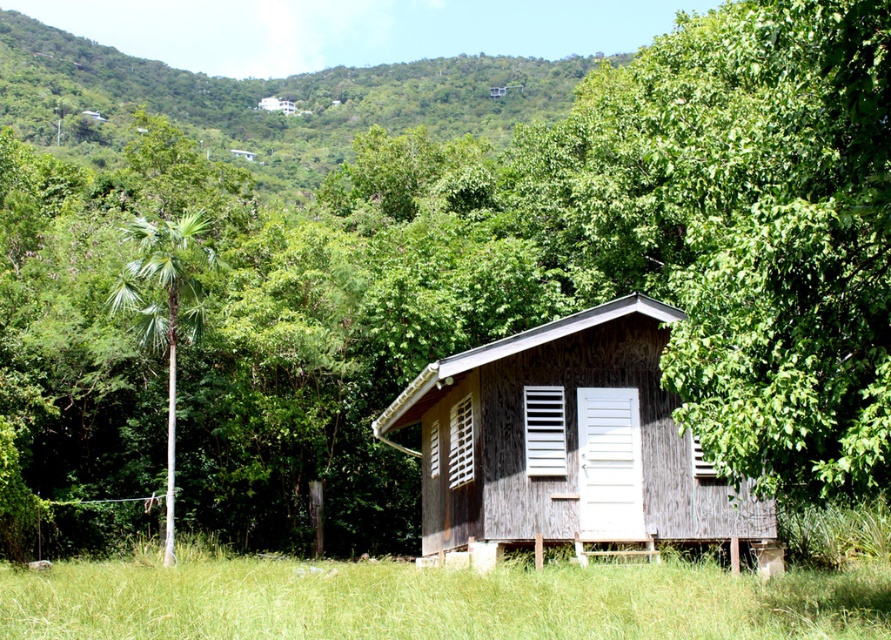
Question: Does green leafy palm tree at left have a smaller size compared to wooden slats at center?

Choices:
 (A) yes
 (B) no

Answer: (B)

Question: Can you confirm if green grass at lower center is positioned to the right of green leafy hillside at upper left?

Choices:
 (A) no
 (B) yes

Answer: (B)

Question: Does green leafy hillside at upper left appear over white matte vent at center?

Choices:
 (A) yes
 (B) no

Answer: (A)

Question: Based on their relative distances, which object is farther from the white matte vent at center?

Choices:
 (A) green grass at lower center
 (B) wooden slats at center
 (C) green leafy palm tree at left

Answer: (C)

Question: Which object is positioned farthest from the green leafy hillside at upper left?

Choices:
 (A) weathered wood hut at center
 (B) white matte vent at center

Answer: (B)

Question: Which of the following is the farthest from the observer?

Choices:
 (A) white wooden door at center
 (B) green grass at lower center
 (C) weathered wood hut at center
 (D) white matte vent at center

Answer: (D)